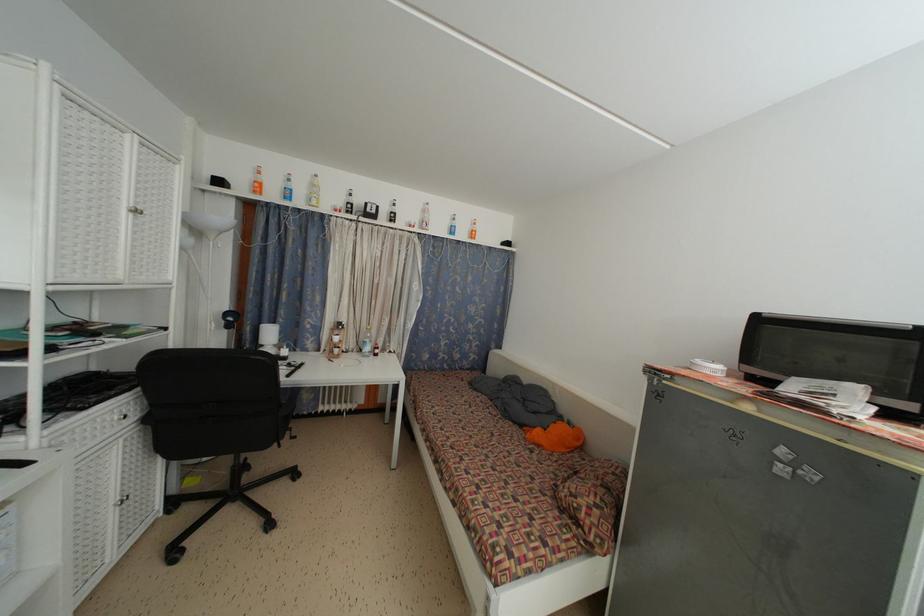
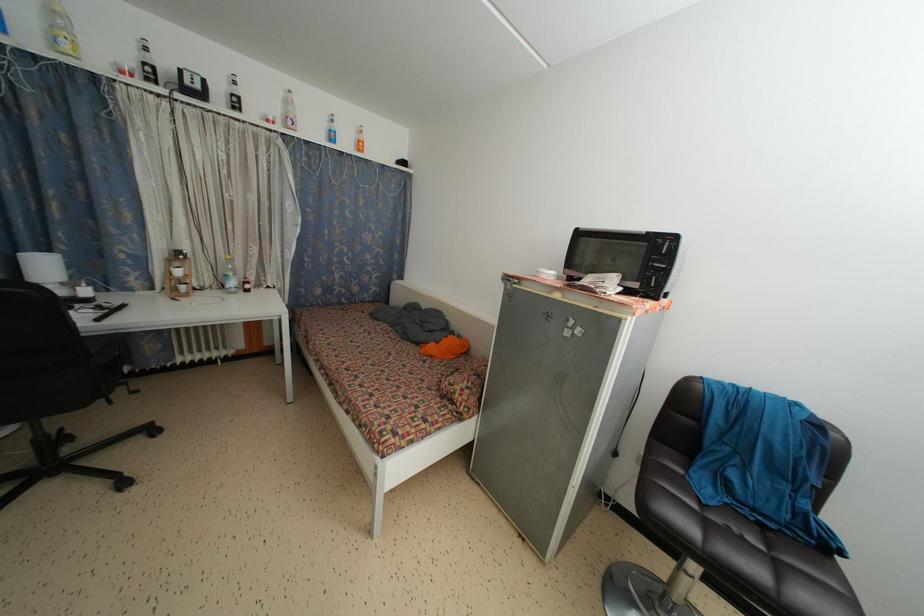
Find the pixel in the second image that matches pixel 351 209 in the first image.

(149, 70)